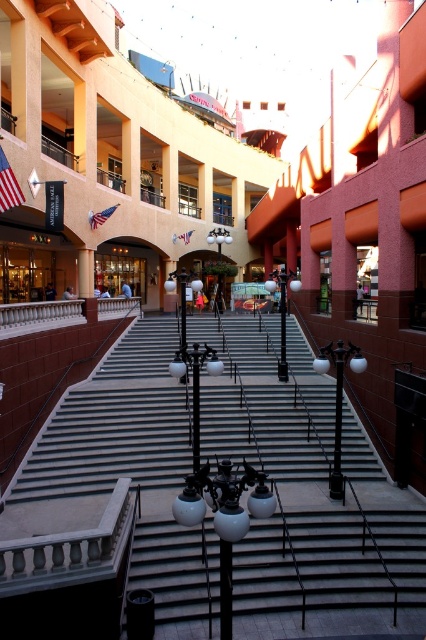
Is white marble stairs at center further to the viewer compared to american flag at upper center?

No, white marble stairs at center is closer to the viewer.

Can you confirm if white marble stairs at center is bigger than american flag at upper center?

Correct, white marble stairs at center is larger in size than american flag at upper center.

Where is `white marble stairs at center`? white marble stairs at center is located at coordinates (112, 484).

Is white marble stairs at center to the left of american flag at upper left from the viewer's perspective?

No, white marble stairs at center is not to the left of american flag at upper left.

Is point (351, 509) positioned in front of point (8, 188)?

Yes, it is in front of point (8, 188).

At what (x,y) coordinates should I click in order to perform the action: click on white marble stairs at center. Please return your answer as a coordinate pair (x, y). The width and height of the screenshot is (426, 640). Looking at the image, I should click on (112, 484).

Between american flag at upper left and american flag at upper center, which one appears on the left side from the viewer's perspective?

From the viewer's perspective, american flag at upper left appears more on the left side.

Can you confirm if american flag at upper left is positioned to the left of american flag at upper center?

Yes, american flag at upper left is to the left of american flag at upper center.

At what (x,y) coordinates should I click in order to perform the action: click on american flag at upper left. Please return your answer as a coordinate pair (x, y). Looking at the image, I should click on (8, 186).